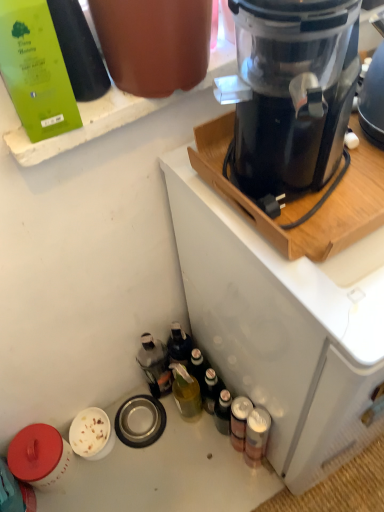
Question: From a real-world perspective, is metallic silver can at lower right, arranged as the third bottle when viewed from the left, located beneath green matte bottle at upper left, which ranks as the first bottle in left-to-right order?

Choices:
 (A) yes
 (B) no

Answer: (A)

Question: From the image's perspective, is metallic silver can at lower right, positioned as the 1th bottle in right-to-left order, on top of green matte bottle at upper left, the third bottle from the right?

Choices:
 (A) yes
 (B) no

Answer: (B)

Question: Considering the relative positions of metallic silver can at lower right, the 2th bottle positioned from the front, and green matte bottle at upper left, positioned as the 1th bottle in top-to-bottom order, in the image provided, is metallic silver can at lower right, the 2th bottle positioned from the front, to the right of green matte bottle at upper left, positioned as the 1th bottle in top-to-bottom order, from the viewer's perspective?

Choices:
 (A) yes
 (B) no

Answer: (A)

Question: Is metallic silver can at lower right, positioned as the 1th bottle in right-to-left order, located outside green matte bottle at upper left, the first bottle from the front?

Choices:
 (A) yes
 (B) no

Answer: (A)

Question: Is green matte bottle at upper left, the first bottle from the front, inside metallic silver can at lower right, positioned as the 1th bottle in right-to-left order?

Choices:
 (A) no
 (B) yes

Answer: (A)

Question: Is metallic silver can at lower right, arranged as the third bottle when viewed from the left, smaller than green matte bottle at upper left, positioned as the 1th bottle in top-to-bottom order?

Choices:
 (A) yes
 (B) no

Answer: (A)

Question: Does metallic silver can at lower right, positioned as the 1th bottle in right-to-left order, have a larger size compared to black plastic blender at upper right?

Choices:
 (A) no
 (B) yes

Answer: (A)

Question: Considering the relative positions of metallic silver can at lower right, the 3th bottle when ordered from top to bottom, and black plastic blender at upper right in the image provided, is metallic silver can at lower right, the 3th bottle when ordered from top to bottom, to the right of black plastic blender at upper right from the viewer's perspective?

Choices:
 (A) yes
 (B) no

Answer: (B)

Question: Can you confirm if metallic silver can at lower right, the 3th bottle when ordered from top to bottom, is shorter than black plastic blender at upper right?

Choices:
 (A) no
 (B) yes

Answer: (B)

Question: Is metallic silver can at lower right, the 2th bottle positioned from the front, touching black plastic blender at upper right?

Choices:
 (A) no
 (B) yes

Answer: (A)

Question: Is black plastic blender at upper right a part of metallic silver can at lower right, arranged as the third bottle when viewed from the left?

Choices:
 (A) no
 (B) yes

Answer: (A)

Question: From a real-world perspective, does metallic silver can at lower right, the 2th bottle in the back-to-front sequence, sit lower than black plastic blender at upper right?

Choices:
 (A) no
 (B) yes

Answer: (B)

Question: Can you confirm if black plastic blender at upper right is positioned to the left of green matte bottle at upper left, which ranks as the 3th bottle in back-to-front order?

Choices:
 (A) yes
 (B) no

Answer: (B)